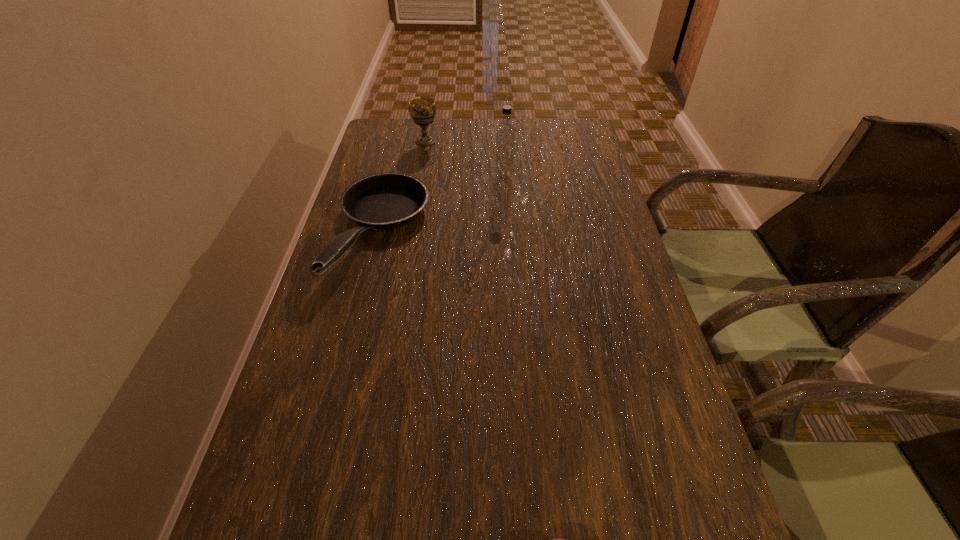
Locate an element on the screen. vacant space that satisfies the following two spatial constraints: 1. on the front side of the tallest object; 2. on the left side of the farthest object is located at coordinates (420, 178).

Identify the location of vacant space that satisfies the following two spatial constraints: 1. on the front side of the chalice; 2. on the left side of the water bottle. This screenshot has width=960, height=540. (420, 178).